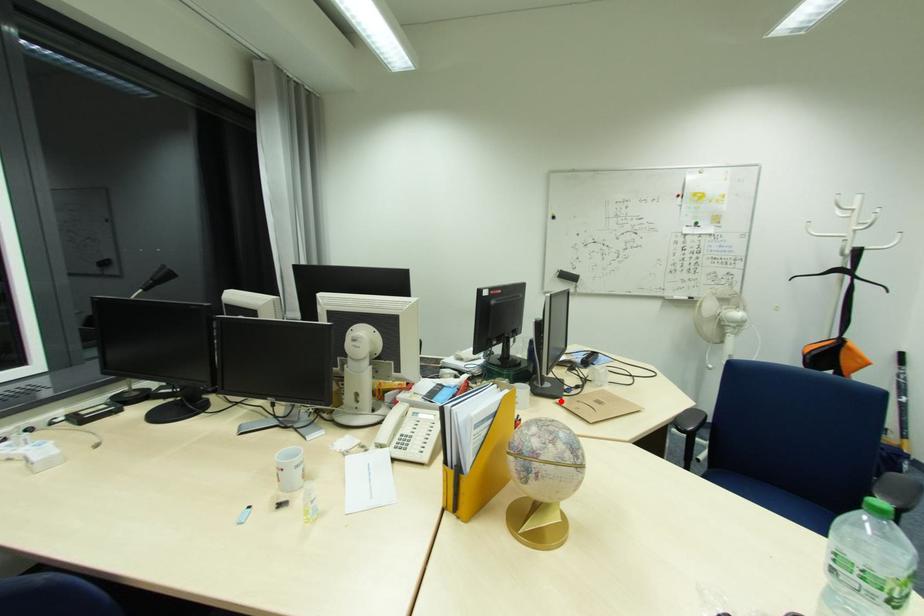
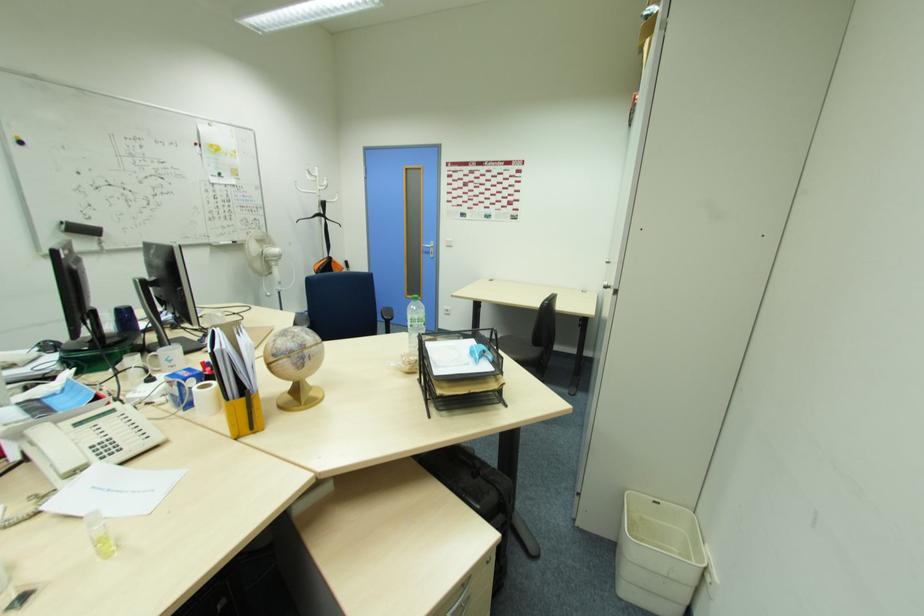
Question: I am providing you with two images of the same scene from different viewpoints. A red point is marked on the first image. At the location where the point appears in image 1, is it still visible in image 2?

Choices:
 (A) Yes
 (B) No

Answer: (A)